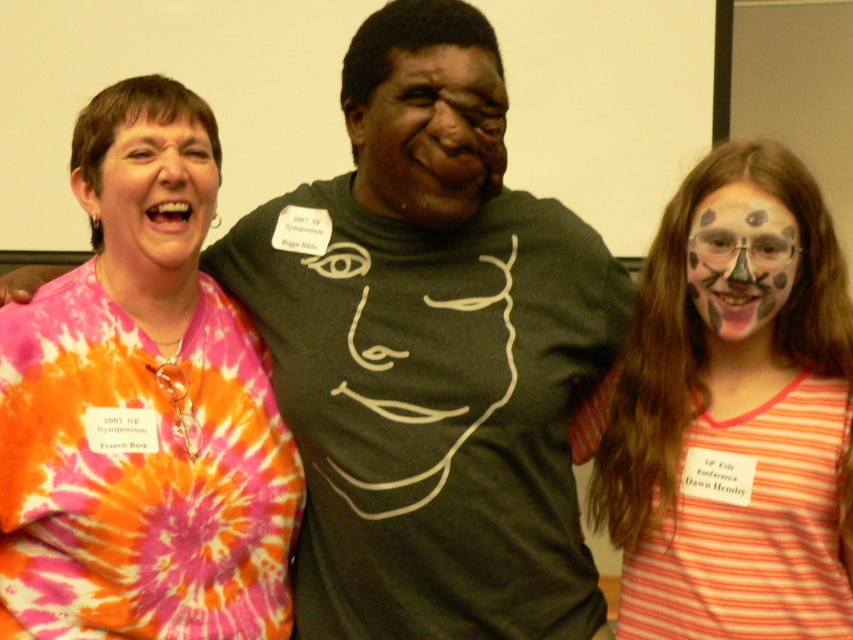
Question: Does tie-dye fabric shirt at left lie behind matte black face at center?

Choices:
 (A) no
 (B) yes

Answer: (B)

Question: Is striped cotton shirt at right to the right of painted face at right from the viewer's perspective?

Choices:
 (A) no
 (B) yes

Answer: (A)

Question: Which point appears farthest from the camera in this image?

Choices:
 (A) (457, 198)
 (B) (239, 468)
 (C) (653, 614)

Answer: (B)

Question: Among these points, which one is farthest from the camera?

Choices:
 (A) (125, 248)
 (B) (782, 400)
 (C) (740, 230)

Answer: (A)

Question: Which point is closer to the camera taking this photo?

Choices:
 (A) (786, 268)
 (B) (416, 49)

Answer: (B)

Question: Can you confirm if matte black face at center is positioned above tie-dye fabric at left?

Choices:
 (A) no
 (B) yes

Answer: (B)